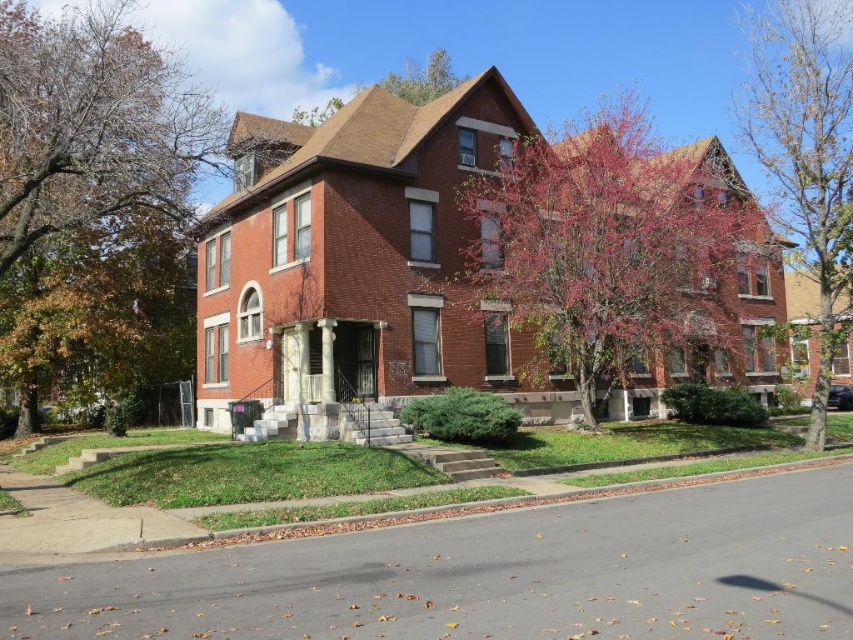
You are standing at the front door of the two story brick house and want to place a new garden statue exactly at the center of the lawn. The brown textured tree at upper left is located at coordinate point 0.195, 0.111. Can you determine if the statue will be closer to the house or the tree?

The brown textured tree at upper left is located at coordinate point (94, 124). Since the statue is placed at the center of the lawn, it will be closer to the house than the tree because the tree is positioned near the edge of the lawn closer to the house.

You are a landscape architect planning to add a new garden bed between the smooth bark tree at right and the green leafy tree at upper center. Considering their widths, which tree requires more space to accommodate its spread?

The smooth bark tree at right requires more space because its width surpasses that of the green leafy tree at upper center.